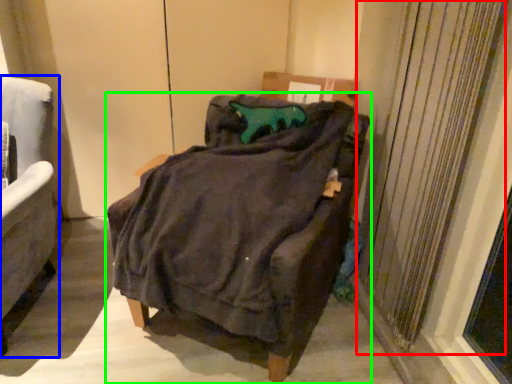
Question: Estimate the real-world distances between objects in this image. Which object is closer to curtain (highlighted by a red box), chair (highlighted by a blue box) or chair (highlighted by a green box)?

Choices:
 (A) chair
 (B) chair

Answer: (B)